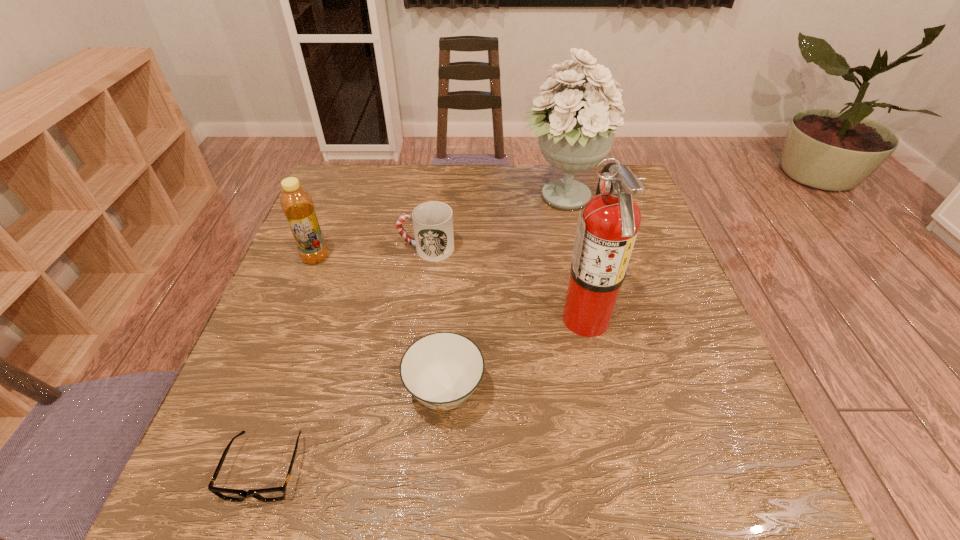
Image resolution: width=960 pixels, height=540 pixels. In order to click on free region that satisfies the following two spatial constraints: 1. on the nozzle side of the fire extinguisher; 2. on the front-facing side of the shortest object in this screenshot , I will do `click(618, 468)`.

Where is `free space that satisfies the following two spatial constraints: 1. on the nozzle side of the third nearest object; 2. on the front-facing side of the shortest object`? free space that satisfies the following two spatial constraints: 1. on the nozzle side of the third nearest object; 2. on the front-facing side of the shortest object is located at coordinates (618, 468).

Identify the location of free location that satisfies the following two spatial constraints: 1. on the front side of the bottle; 2. on the left side of the second shortest object. click(x=264, y=390).

Locate an element on the screen. free space that satisfies the following two spatial constraints: 1. on the nozzle side of the fire extinguisher; 2. on the front-facing side of the shortest object is located at coordinates (618, 468).

What are the coordinates of `free region that satisfies the following two spatial constraints: 1. on the side of the farthest object where the handle is located; 2. on the right side of the cup` in the screenshot? It's located at (434, 198).

Find the location of a particular element. The height and width of the screenshot is (540, 960). free space that satisfies the following two spatial constraints: 1. on the side of the third shortest object where the handle is located; 2. on the left side of the bouquet is located at coordinates (434, 198).